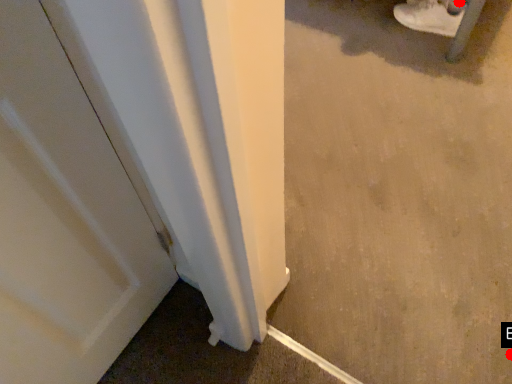
Question: Two points are circled on the image, labeled by A and B beside each circle. Which of the following is the closest to the observer?

Choices:
 (A) A is closer
 (B) B is closer

Answer: (B)